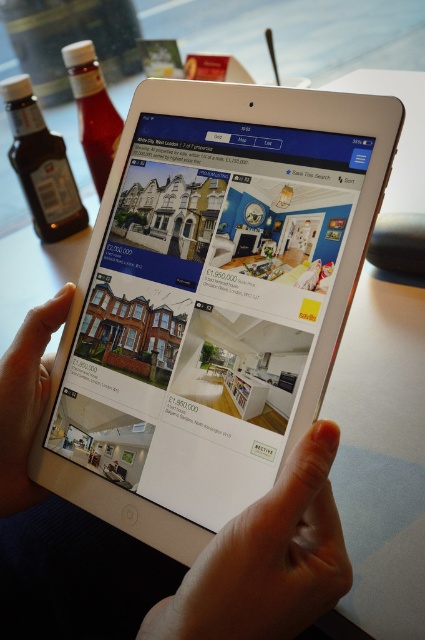
You are a real estate agent looking at the tablet screen. You need to tap the listing for the house priced at exactly 1,950,000 pounds. Based on the spatial arrangement of the smooth white tablet at center and the skinny white finger at upper center, can your finger reach the target listing without moving the tablet?

The smooth white tablet at center is above the skinny white finger at upper center, so the finger is positioned below the tablet. Since the finger is already at the upper part of the tablet, it should be able to reach the listing for the house priced at 1,950,000 pounds without needing to move the tablet.

You are holding a tablet and want to touch the two points on the screen simultaneously with both index fingers. The points are located at coordinates point (252, 141) and another point. Can your fingers reach them without moving your hands?

The two points are 15.14 inches apart. Since the average distance between index fingers on an adult hand is about 6 inches when spread apart, it is unlikely that you can reach both points simultaneously without moving your hands.

You are a real estate agent helping a client navigate the tablet screen. The client wants to tap the point at coordinates (266, 560) to view more details about a property. Based on the scene, where is this point located?

The point at coordinates (266, 560) is located on the skinny white finger at upper center, which suggests the finger is interacting with the tablet screen.